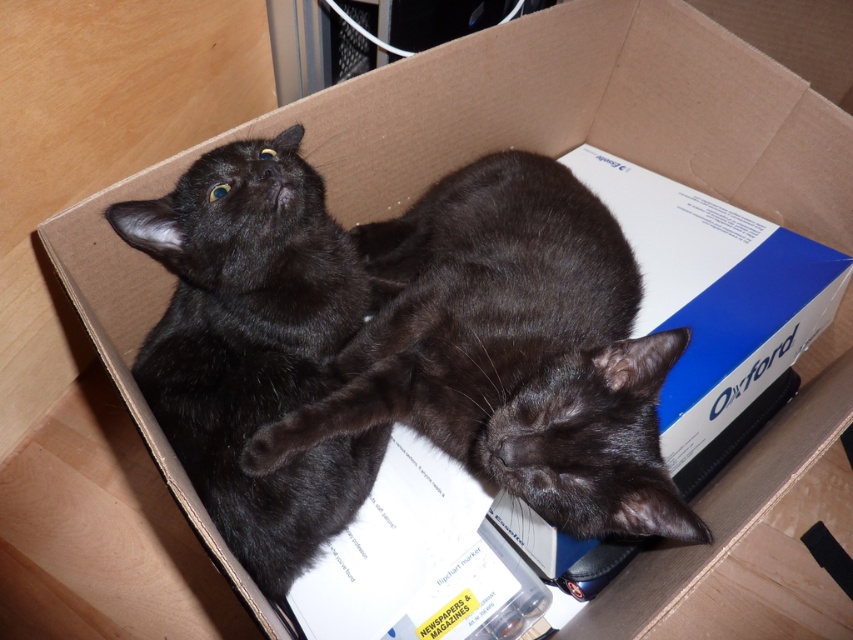
Question: Which point is closer to the camera?

Choices:
 (A) black fur cat at upper left
 (B) black fur cat at center

Answer: (B)

Question: Is black fur cat at center wider than black fur cat at upper left?

Choices:
 (A) no
 (B) yes

Answer: (B)

Question: Is black fur cat at center above black fur cat at upper left?

Choices:
 (A) yes
 (B) no

Answer: (B)

Question: Which object appears farthest from the camera in this image?

Choices:
 (A) black fur cat at upper left
 (B) black fur cat at center

Answer: (A)

Question: Where is black fur cat at center located in relation to black fur cat at upper left in the image?

Choices:
 (A) right
 (B) left

Answer: (A)

Question: Which of the following is the closest to the observer?

Choices:
 (A) black fur cat at upper left
 (B) black fur cat at center

Answer: (B)